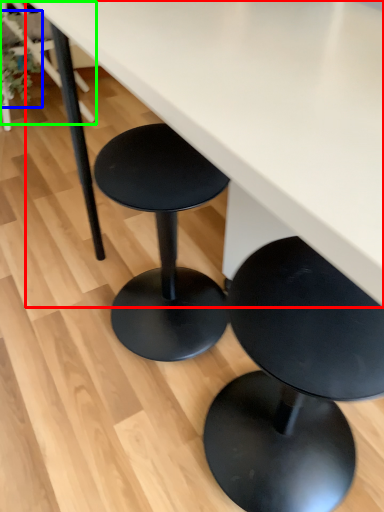
Question: Considering the real-world distances, which object is farthest from table (highlighted by a red box)? plant (highlighted by a blue box) or chair (highlighted by a green box)?

Choices:
 (A) plant
 (B) chair

Answer: (B)